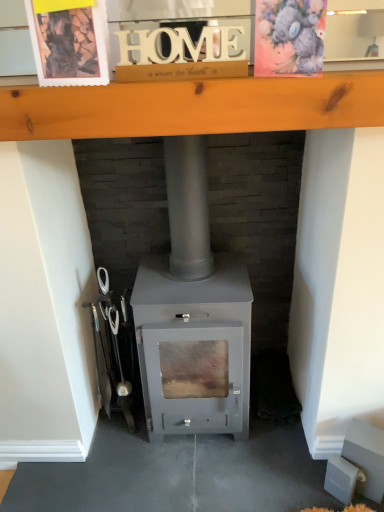
Question: From the image's perspective, is matte gray wood burning stove at center on top of watercolor paper postcard at upper right, the 1th postcard in the right-to-left sequence?

Choices:
 (A) yes
 (B) no

Answer: (B)

Question: Could watercolor paper postcard at upper right, the 1th postcard in the right-to-left sequence, be considered to be inside matte gray wood burning stove at center?

Choices:
 (A) yes
 (B) no

Answer: (B)

Question: Considering the relative sizes of matte gray wood burning stove at center and watercolor paper postcard at upper right, acting as the second postcard starting from the left, in the image provided, is matte gray wood burning stove at center bigger than watercolor paper postcard at upper right, acting as the second postcard starting from the left,?

Choices:
 (A) no
 (B) yes

Answer: (B)

Question: From the image's perspective, is matte gray wood burning stove at center beneath watercolor paper postcard at upper right, the 1th postcard in the right-to-left sequence?

Choices:
 (A) no
 (B) yes

Answer: (B)

Question: Is matte gray wood burning stove at center looking in the opposite direction of watercolor paper postcard at upper right, acting as the second postcard starting from the left?

Choices:
 (A) no
 (B) yes

Answer: (A)

Question: From their relative heights in the image, would you say wooden at upper center is taller or shorter than watercolor paper postcard at upper right, acting as the second postcard starting from the left?

Choices:
 (A) short
 (B) tall

Answer: (A)

Question: Does point (309, 88) appear closer or farther from the camera than point (311, 61)?

Choices:
 (A) farther
 (B) closer

Answer: (A)

Question: Is wooden at upper center situated inside watercolor paper postcard at upper right, acting as the second postcard starting from the left, or outside?

Choices:
 (A) outside
 (B) inside

Answer: (A)

Question: From a real-world perspective, relative to watercolor paper postcard at upper right, acting as the second postcard starting from the left, is wooden at upper center vertically above or below?

Choices:
 (A) below
 (B) above

Answer: (A)

Question: Is wooden postcard at upper left, the second postcard viewed from the right, inside or outside of wooden at upper center?

Choices:
 (A) inside
 (B) outside

Answer: (B)

Question: From a real-world perspective, is wooden postcard at upper left, acting as the 1th postcard starting from the left, above or below wooden at upper center?

Choices:
 (A) above
 (B) below

Answer: (A)

Question: In terms of height, does wooden postcard at upper left, acting as the 1th postcard starting from the left, look taller or shorter compared to wooden at upper center?

Choices:
 (A) tall
 (B) short

Answer: (A)

Question: Considering the relative positions of wooden postcard at upper left, the second postcard viewed from the right, and wooden at upper center in the image provided, is wooden postcard at upper left, the second postcard viewed from the right, to the left or to the right of wooden at upper center?

Choices:
 (A) right
 (B) left

Answer: (B)

Question: From their relative heights in the image, would you say watercolor paper postcard at upper right, acting as the second postcard starting from the left, is taller or shorter than matte gray wood burning stove at center?

Choices:
 (A) short
 (B) tall

Answer: (A)

Question: Does point (319, 10) appear closer or farther from the camera than point (203, 245)?

Choices:
 (A) farther
 (B) closer

Answer: (B)